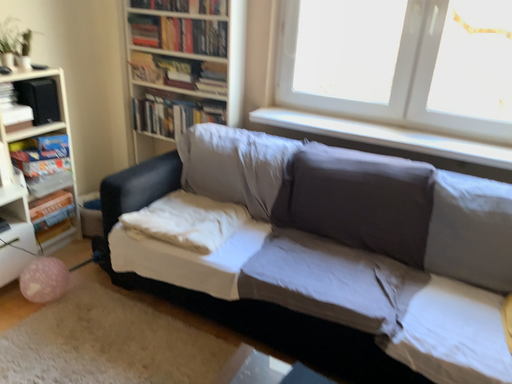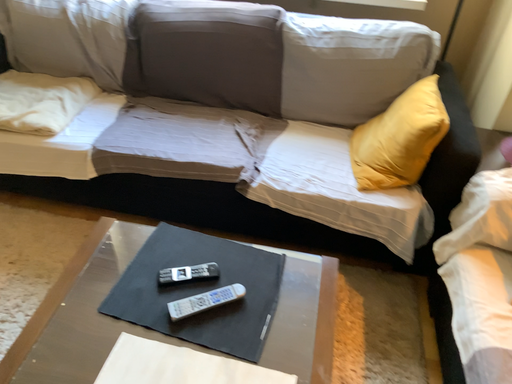
Question: Which way did the camera rotate in the video?

Choices:
 (A) rotated downward
 (B) rotated upward

Answer: (A)